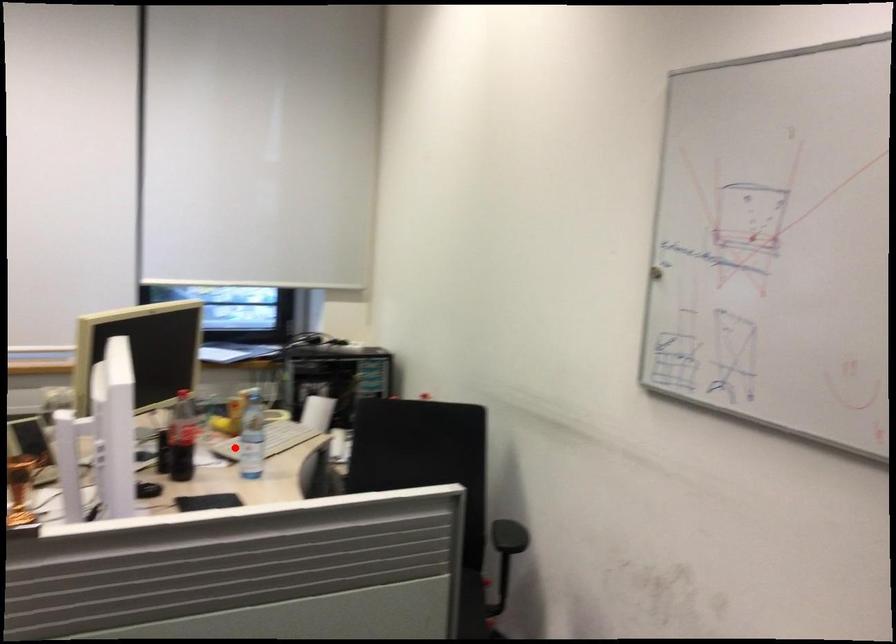
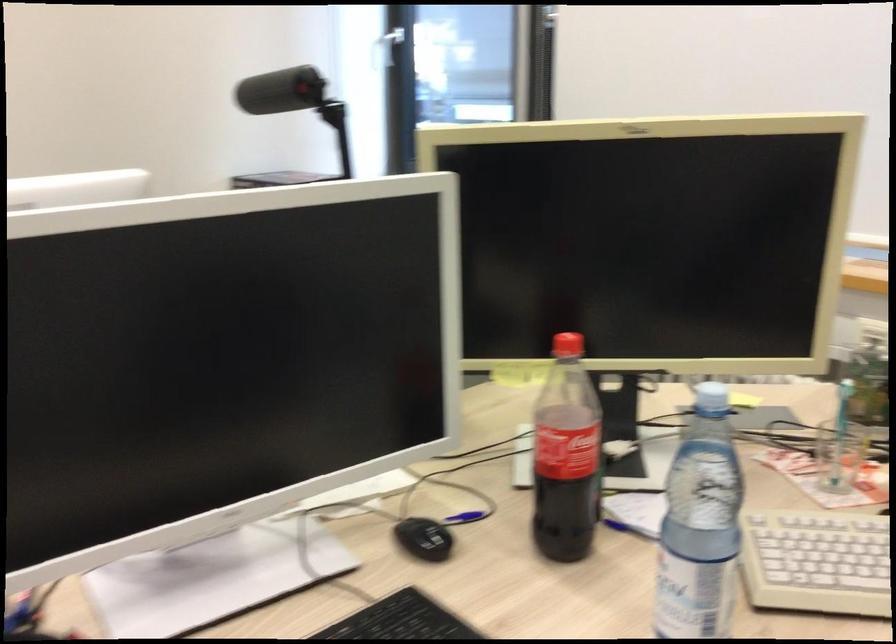
Question: I am providing you with two images of the same scene from different viewpoints. Given a red point in image1, look at the same physical point in image2. Is it:

Choices:
 (A) Closer to the viewpoint
 (B) Farther from the viewpoint

Answer: (A)